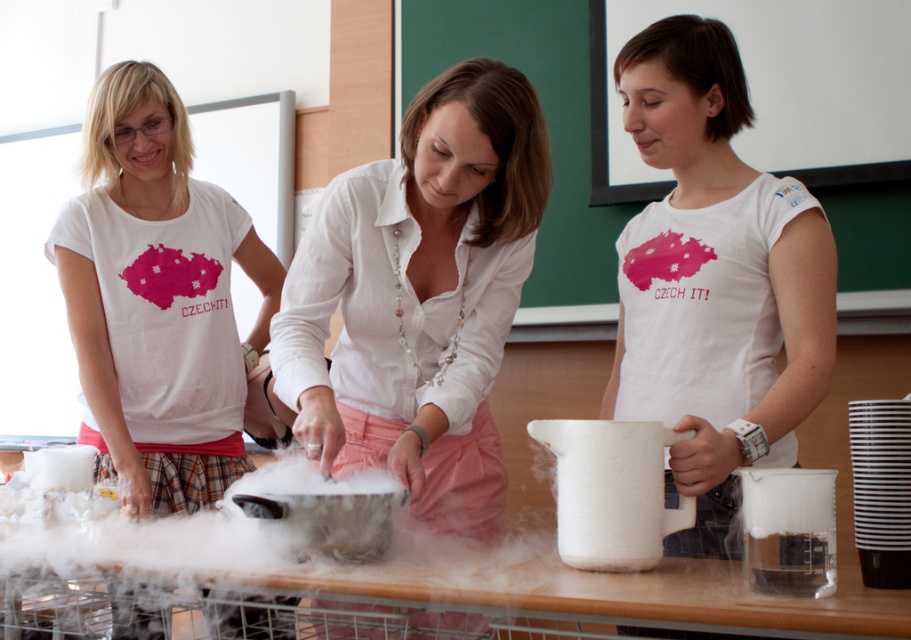
Is white linen shirt at center to the left of white matte t-shirt at center from the viewer's perspective?

Correct, you'll find white linen shirt at center to the left of white matte t-shirt at center.

Based on the photo, does white linen shirt at center lie in front of white matte t-shirt at center?

Yes.

Where is `white linen shirt at center`? The height and width of the screenshot is (640, 911). white linen shirt at center is located at coordinates (420, 296).

Identify the location of white linen shirt at center. (420, 296).

Measure the distance between white linen shirt at center and camera.

A distance of 1.24 meters exists between white linen shirt at center and camera.

Can you confirm if white linen shirt at center is positioned above matte white shirt at center?

Actually, white linen shirt at center is below matte white shirt at center.

Image resolution: width=911 pixels, height=640 pixels. Find the location of `white linen shirt at center`. white linen shirt at center is located at coordinates (420, 296).

Is point (615, 376) positioned before point (109, 188)?

Yes, point (615, 376) is in front of point (109, 188).

Locate an element on the screen. white matte t-shirt at center is located at coordinates (714, 282).

Where is `white matte t-shirt at center`? The height and width of the screenshot is (640, 911). white matte t-shirt at center is located at coordinates (714, 282).